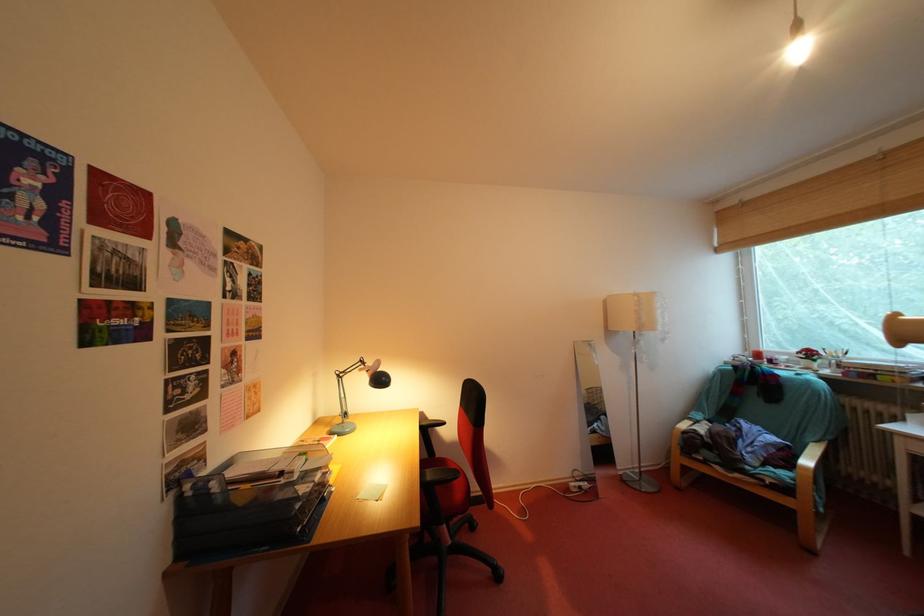
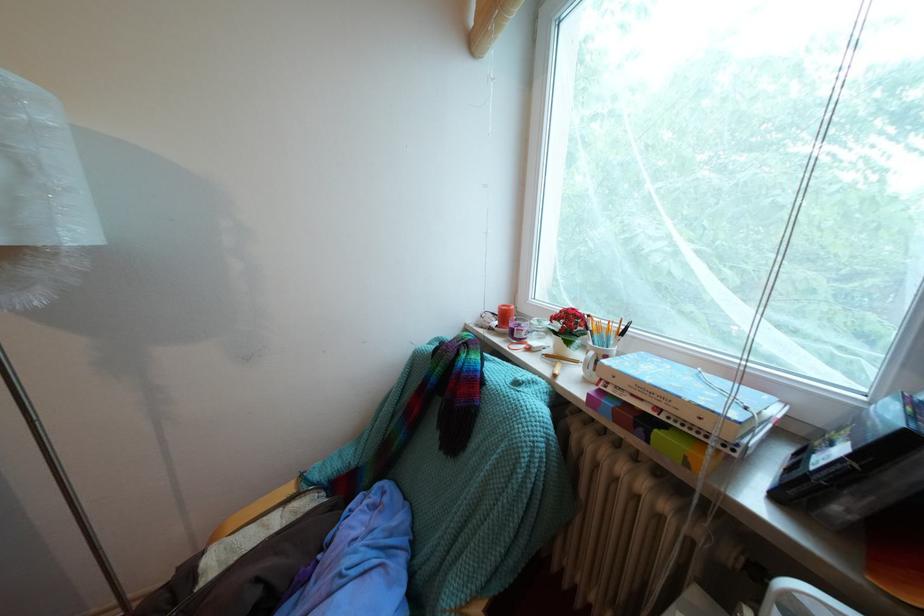
Which direction would the cameraman need to move to produce the second image?

The movement direction of the cameraman is right, forward.